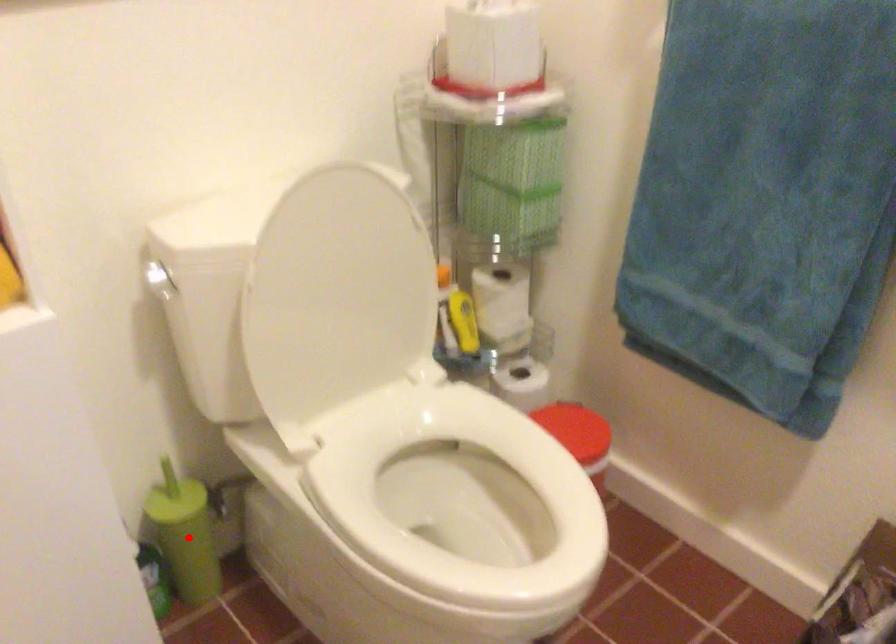
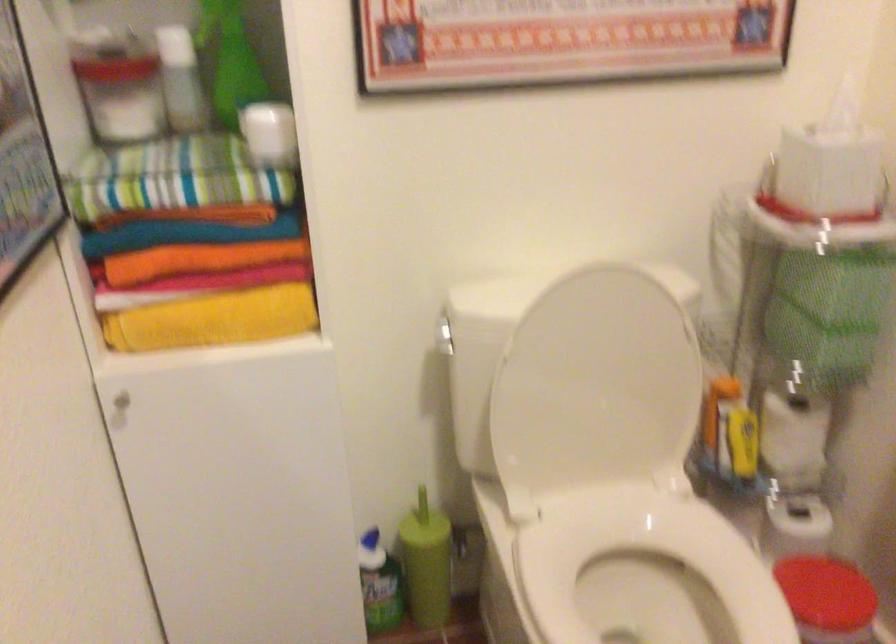
Question: I am providing you with two images of the same scene from different viewpoints. Given a red point in image1, look at the same physical point in image2. Is it:

Choices:
 (A) Closer to the viewpoint
 (B) Farther from the viewpoint

Answer: (B)